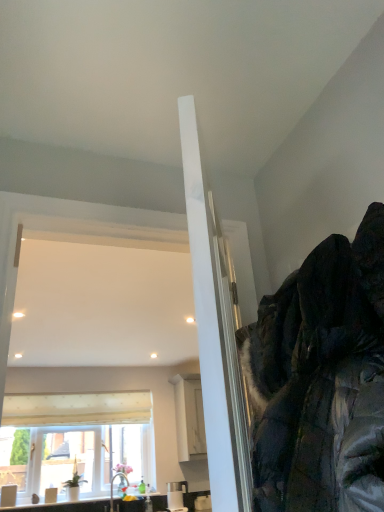
Question: Considering the relative sizes of white textured window at center and white glossy sink at lower left, the second sink positioned from the right, in the image provided, is white textured window at center shorter than white glossy sink at lower left, the second sink positioned from the right,?

Choices:
 (A) no
 (B) yes

Answer: (A)

Question: Does white textured window at center touch white glossy sink at lower left, the 1th sink from the left?

Choices:
 (A) no
 (B) yes

Answer: (A)

Question: Can white glossy sink at lower left, the second sink positioned from the right, be found inside white textured window at center?

Choices:
 (A) yes
 (B) no

Answer: (B)

Question: From the image's perspective, is white textured window at center located above white glossy sink at lower left, the second sink positioned from the right?

Choices:
 (A) no
 (B) yes

Answer: (B)

Question: Is white textured window at center closer to the viewer compared to white glossy sink at lower left, the 1th sink from the left?

Choices:
 (A) no
 (B) yes

Answer: (A)

Question: Does white textured window at center have a smaller size compared to white glossy sink at lower left, the second sink positioned from the right?

Choices:
 (A) yes
 (B) no

Answer: (B)

Question: Is white glossy sink at lower left, the 1th sink from the left, not near matte white sink at lower left, acting as the first sink starting from the right?

Choices:
 (A) yes
 (B) no

Answer: (B)

Question: Is matte white sink at lower left, which is counted as the 2th sink, starting from the left, inside white glossy sink at lower left, the second sink positioned from the right?

Choices:
 (A) no
 (B) yes

Answer: (A)

Question: Can you confirm if white glossy sink at lower left, the second sink positioned from the right, is positioned to the right of matte white sink at lower left, which is counted as the 2th sink, starting from the left?

Choices:
 (A) yes
 (B) no

Answer: (B)

Question: From a real-world perspective, does white glossy sink at lower left, the second sink positioned from the right, stand above matte white sink at lower left, acting as the first sink starting from the right?

Choices:
 (A) no
 (B) yes

Answer: (A)

Question: Is white glossy sink at lower left, the 1th sink from the left, positioned with its back to matte white sink at lower left, which is counted as the 2th sink, starting from the left?

Choices:
 (A) yes
 (B) no

Answer: (B)

Question: Does white glossy sink at lower left, the 1th sink from the left, have a larger size compared to matte white sink at lower left, acting as the first sink starting from the right?

Choices:
 (A) yes
 (B) no

Answer: (B)

Question: Considering the relative sizes of dark green textured jacket at upper right and matte white sink at lower left, which is counted as the 2th sink, starting from the left, in the image provided, is dark green textured jacket at upper right wider than matte white sink at lower left, which is counted as the 2th sink, starting from the left,?

Choices:
 (A) yes
 (B) no

Answer: (A)